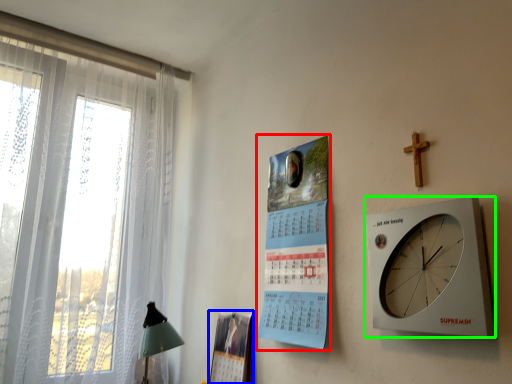
Question: Which object is the farthest from poster page (highlighted by a red box)? Choose among these: magazine (highlighted by a blue box) or wall clock (highlighted by a green box).

Choices:
 (A) magazine
 (B) wall clock

Answer: (B)